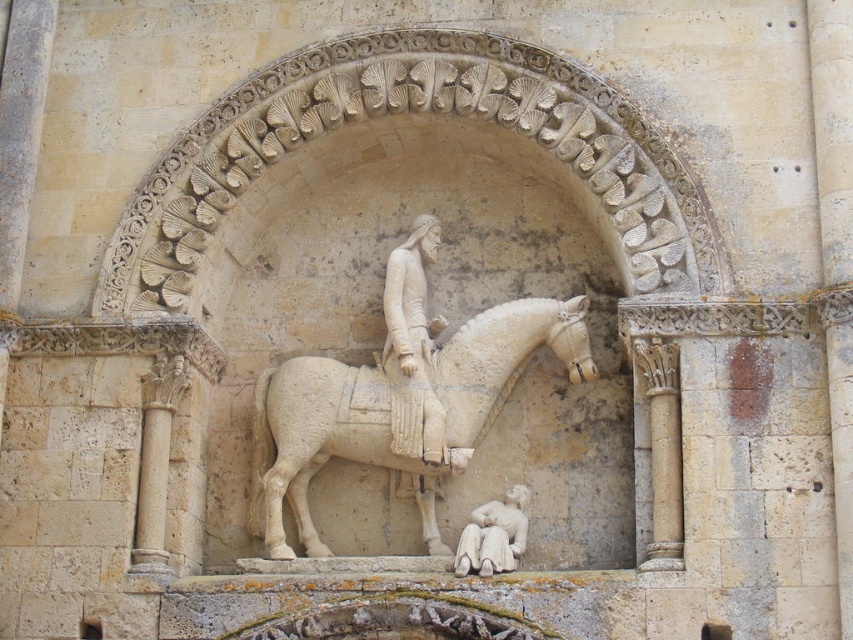
Who is shorter, white stone horse at center or white stone statue at center?

Standing shorter between the two is white stone statue at center.

The height and width of the screenshot is (640, 853). Find the location of `white stone horse at center`. white stone horse at center is located at coordinates pos(323,445).

Locate an element on the screen. This screenshot has width=853, height=640. white stone horse at center is located at coordinates (323, 445).

Consider the image. Is white stone statue at center to the right of white stone reclining figure at lower center from the viewer's perspective?

Incorrect, white stone statue at center is not on the right side of white stone reclining figure at lower center.

Looking at this image, does white stone statue at center have a larger size compared to white stone reclining figure at lower center?

Yes.

Describe the element at coordinates (412, 346) in the screenshot. The image size is (853, 640). I see `white stone statue at center` at that location.

You are a GUI agent. You are given a task and a screenshot of the screen. Output one action in this format:
    pyautogui.click(x=<x>, y=<y>)
    Task: Click on the white stone statue at center
    This screenshot has height=640, width=853.
    Given the screenshot: What is the action you would take?
    [x=412, y=346]

Who is more forward, [492,317] or [502,500]?

Point [502,500] is in front.

Which is in front, point (360, 435) or point (477, 545)?

Positioned in front is point (477, 545).

Where is `white stone horse at center`? white stone horse at center is located at coordinates (323, 445).